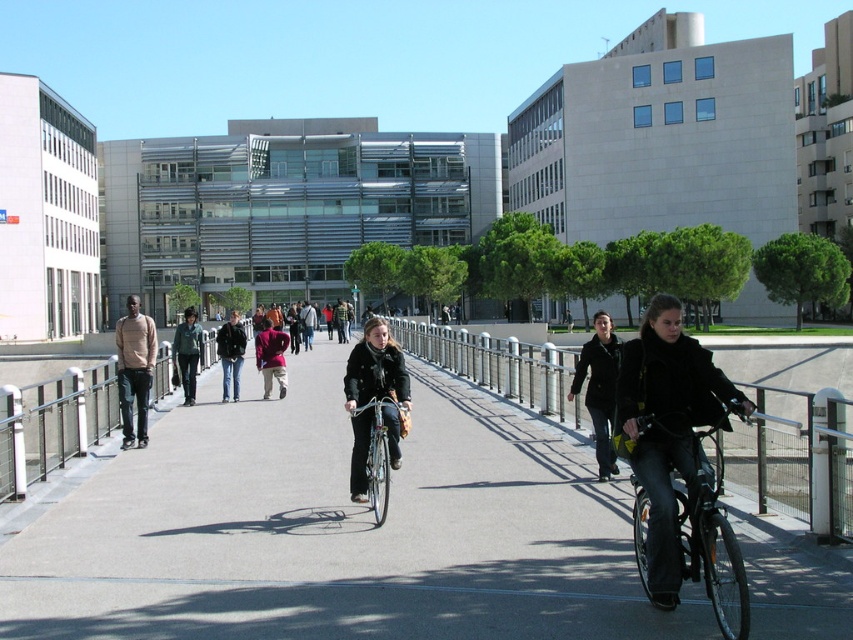
Question: From the image, what is the correct spatial relationship of dark gray jacket at center in relation to dark brown leather jacket at center?

Choices:
 (A) below
 (B) above

Answer: (A)

Question: Among these points, which one is farthest from the camera?

Choices:
 (A) (306, 310)
 (B) (763, 404)
 (C) (206, 624)
 (D) (370, 506)

Answer: (A)

Question: From the image, what is the correct spatial relationship of matte black jacket at center in relation to black leather jacket at center?

Choices:
 (A) right
 (B) left

Answer: (B)

Question: Which object is positioned farthest from the metallic silver railing at center?

Choices:
 (A) concrete pavement at center
 (B) shiny black bicycle at center

Answer: (A)

Question: Among these objects, which one is nearest to the camera?

Choices:
 (A) matte black jacket at center
 (B) shiny black bicycle at center
 (C) light brown sweater at left
 (D) dark gray jacket at center

Answer: (B)

Question: Can you confirm if matte black jacket at center is positioned below light brown sweater at left?

Choices:
 (A) yes
 (B) no

Answer: (A)